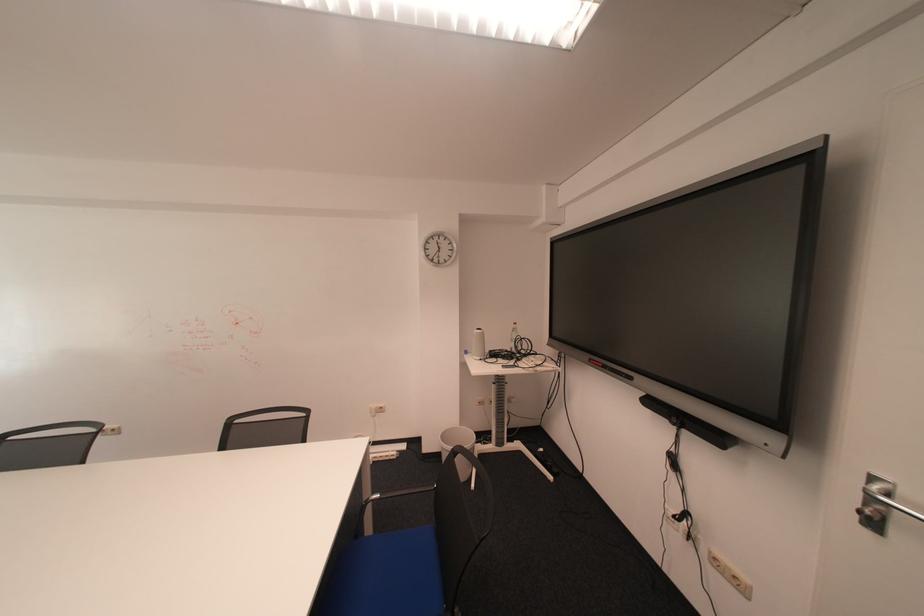
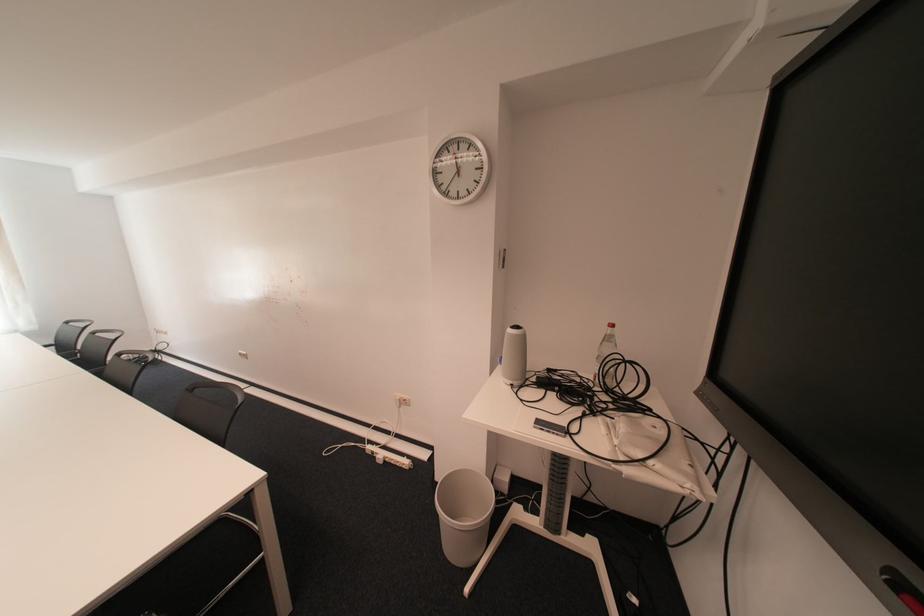
The point at (x=382, y=408) is marked in the first image. Where is the corresponding point in the second image?

(407, 397)